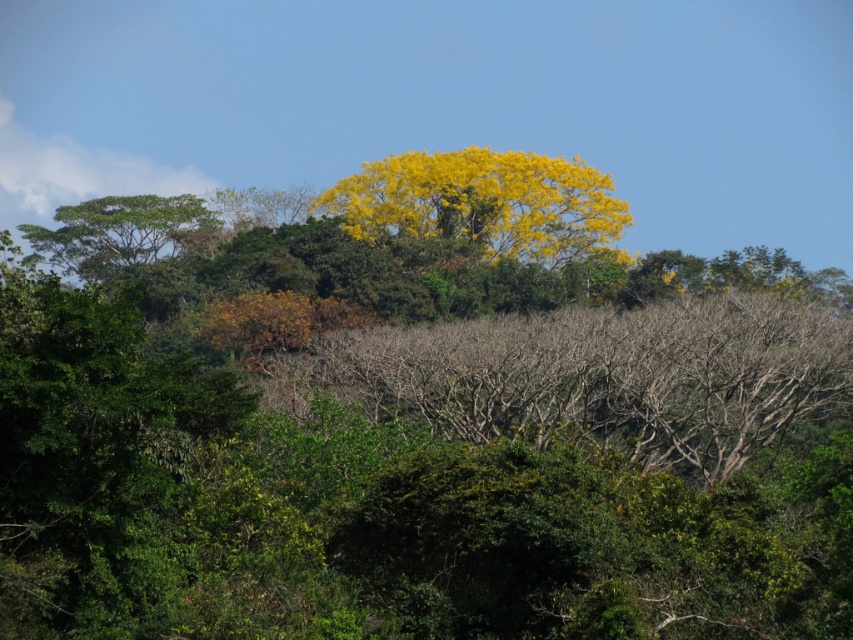
You are planning to plant a new tree in your backyard. You have space for a tree that is up to 3 meters wide. You see the yellow leafy tree at center and the green leafy tree at left in the image. Which tree would be suitable for your space?

The green leafy tree at left would be suitable for your space since its width is less than the yellow leafy tree at center, which is wider than 3 meters. However, if the green leafy tree at left is within the 3 meters width limit, it would fit. Unfortunately, the exact width isn

You are an artist planning to paint the landscape. You want to ensure the yellow leafy tree at center and the green leafy tree at left are placed correctly in your painting. According to the scene, which tree should be drawn to the right of the other?

The yellow leafy tree at center is positioned on the right side of green leafy tree at left, so the yellow leafy tree at center should be drawn to the right of the green leafy tree at left.